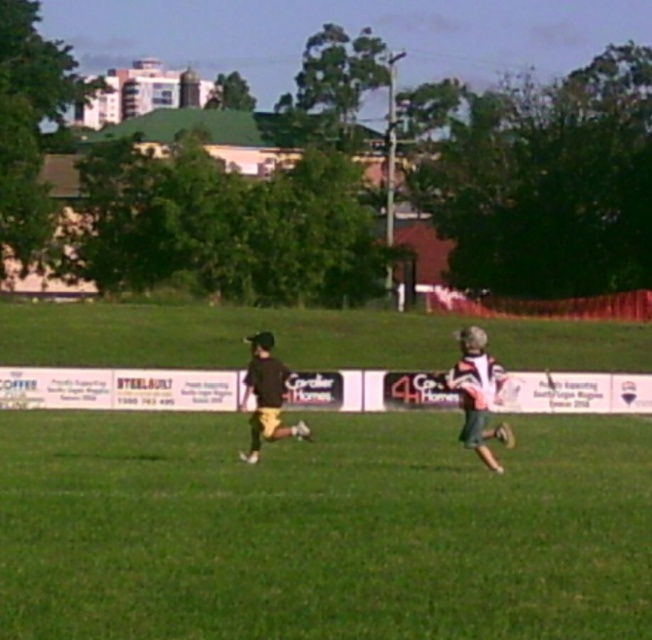
Can you confirm if green grass at center is bigger than dark brown jersey at center?

No.

Between green grass at center and dark brown jersey at center, which one is positioned higher?

dark brown jersey at center is higher up.

Does point (518, 593) come in front of point (286, 426)?

Yes, it is in front of point (286, 426).

Where is `green grass at center`? Image resolution: width=652 pixels, height=640 pixels. green grass at center is located at coordinates (321, 529).

Who is positioned more to the right, striped jersey at right or dark brown jersey at center?

From the viewer's perspective, striped jersey at right appears more on the right side.

Between striped jersey at right and dark brown jersey at center, which one is positioned higher?

striped jersey at right

Image resolution: width=652 pixels, height=640 pixels. Describe the element at coordinates (477, 394) in the screenshot. I see `striped jersey at right` at that location.

Where is `striped jersey at right`? striped jersey at right is located at coordinates (477, 394).

Is green grass at center to the left of striped jersey at right from the viewer's perspective?

Correct, you'll find green grass at center to the left of striped jersey at right.

Which is above, green grass at center or striped jersey at right?

striped jersey at right is above.

Which is behind, point (321, 602) or point (479, 364)?

The point (479, 364) is behind.

You are a GUI agent. You are given a task and a screenshot of the screen. Output one action in this format:
    pyautogui.click(x=<x>, y=<y>)
    Task: Click on the green grass at center
    
    Given the screenshot: What is the action you would take?
    pyautogui.click(x=321, y=529)